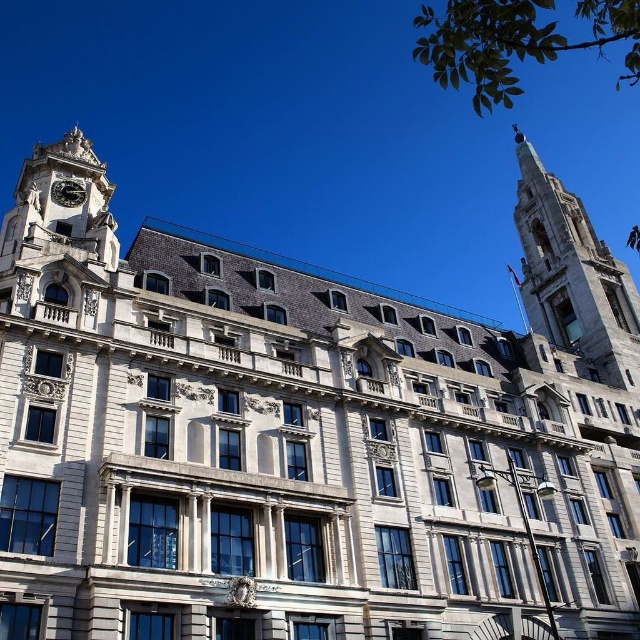
Is polished stone spire at upper right in front of polished brass clock at upper left?

No, it is behind polished brass clock at upper left.

Measure the distance between polished stone spire at upper right and polished brass clock at upper left.

The distance of polished stone spire at upper right from polished brass clock at upper left is 71.61 meters.

What are the coordinates of `polished stone spire at upper right` in the screenshot? It's located at (573, 275).